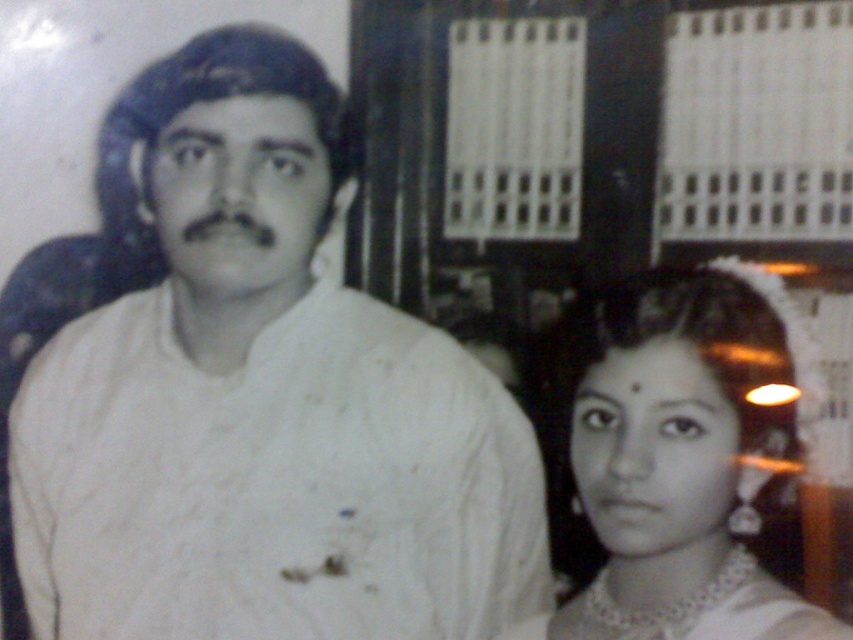
You are an assistant organizing a cultural exhibition and need to determine the placement of two items from the image. The items are the white textured shirt at center and the pearl necklace at center. Based on their sizes, which item should be placed in a taller display case?

The white textured shirt at center has a greater height compared to the pearl necklace at center, so it should be placed in the taller display case.

You are organizing a fashion exhibition and need to display the white textured shirt at center and the pearl necklace at center in a showcase. The showcase has a width of 30 cm. Can both items fit side by side without overlapping?

The white textured shirt at center is wider than the pearl necklace at center. Since the total width of both items combined would exceed the showcase width of 30 cm, they cannot fit side by side without overlapping.